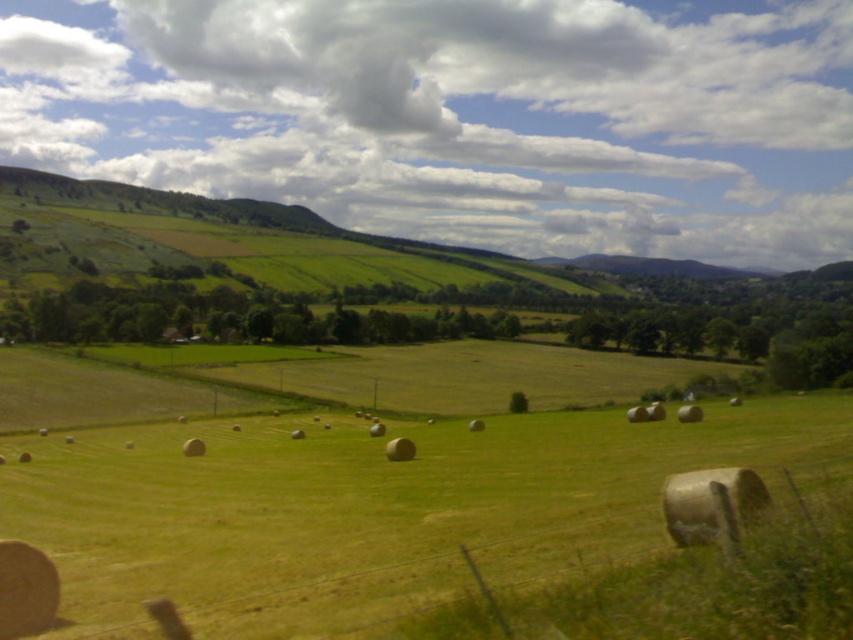
Question: Which of the following is the farthest from the observer?

Choices:
 (A) (523, 570)
 (B) (152, 195)

Answer: (B)

Question: Does green grassy field at center appear over green grassy hillside at upper left?

Choices:
 (A) no
 (B) yes

Answer: (A)

Question: Is green grassy field at center in front of green grassy hillside at upper left?

Choices:
 (A) no
 (B) yes

Answer: (B)

Question: Among these objects, which one is nearest to the camera?

Choices:
 (A) green grassy hillside at upper left
 (B) green grassy field at center

Answer: (B)

Question: Can you confirm if green grassy field at center is positioned above green grassy hillside at upper left?

Choices:
 (A) yes
 (B) no

Answer: (B)

Question: Which point is farther to the camera?

Choices:
 (A) (515, 426)
 (B) (113, 193)

Answer: (B)